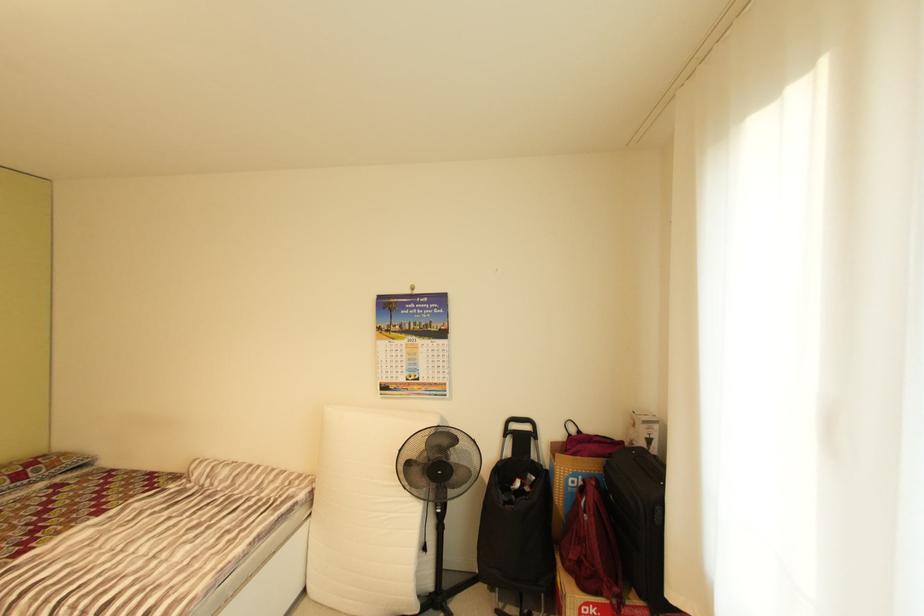
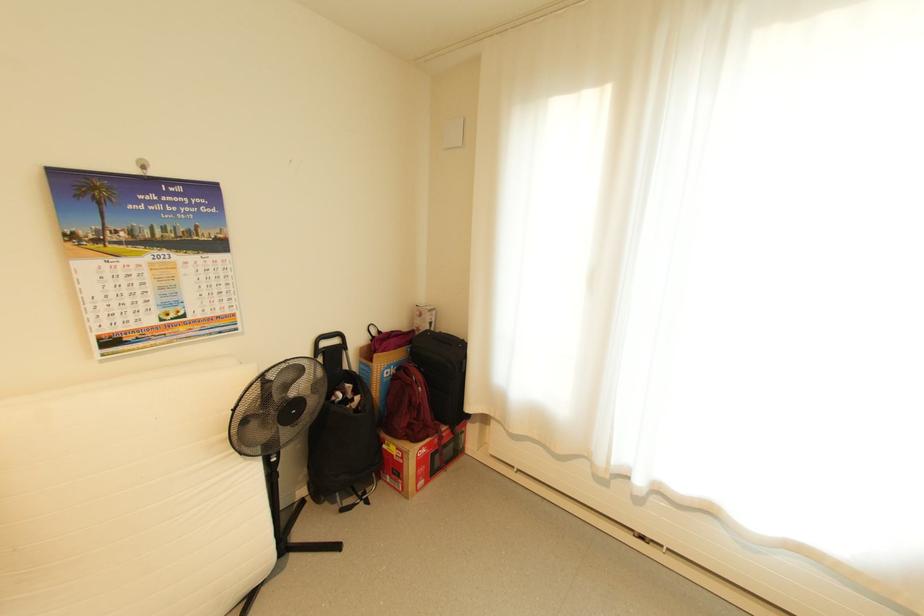
Where in the second image is the point corresponding to (533,428) from the first image?

(342, 342)